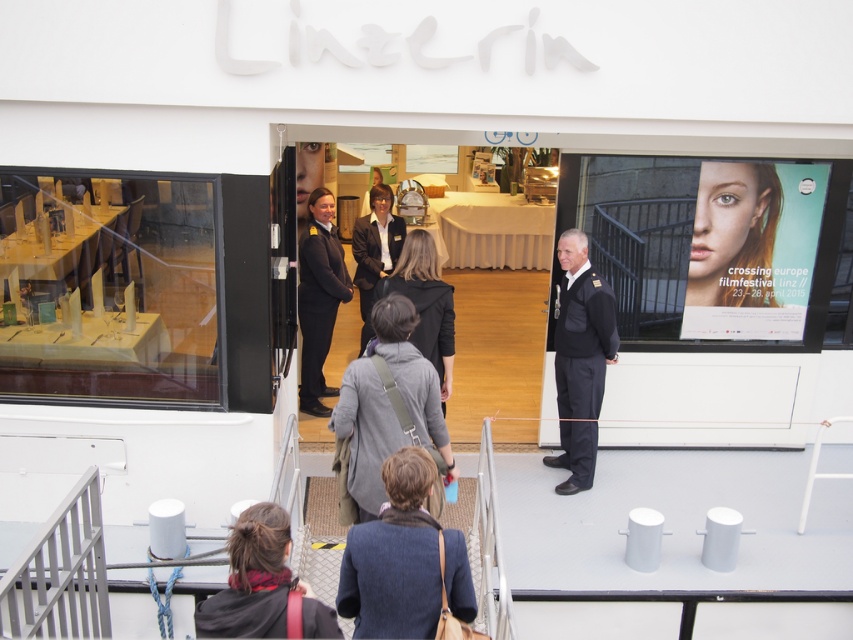
Question: Does blue wool coat at lower center appear on the left side of dark blue fabric business suit at center?

Choices:
 (A) no
 (B) yes

Answer: (A)

Question: Does blue wool coat at lower center appear on the left side of gray fabric coat at center?

Choices:
 (A) no
 (B) yes

Answer: (A)

Question: Which point is closer to the camera?

Choices:
 (A) dark gray wool business suit at center
 (B) smooth skin face at upper right
 (C) gray fabric coat at center
 (D) shiny black uniform at center

Answer: (C)

Question: Can you confirm if dark blue fabric business suit at center is positioned to the left of dark gray wool business suit at center?

Choices:
 (A) no
 (B) yes

Answer: (B)

Question: Which object is positioned closest to the dark blue fabric business suit at center?

Choices:
 (A) smooth skin face at upper right
 (B) brown hair at lower center

Answer: (A)

Question: Which is farther from the dark gray wool business suit at center?

Choices:
 (A) blue wool coat at lower center
 (B) gray fabric coat at center

Answer: (A)